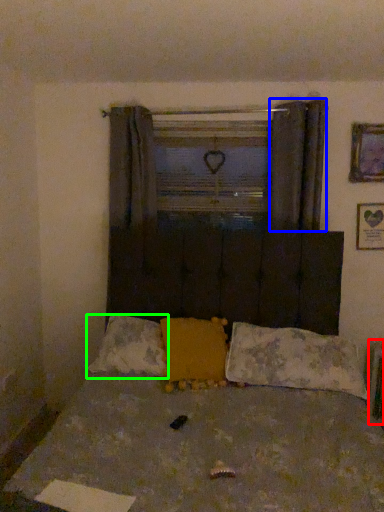
Question: Which is farther away from radiator (highlighted by a red box)? curtain (highlighted by a blue box) or pillow (highlighted by a green box)?

Choices:
 (A) curtain
 (B) pillow

Answer: (B)